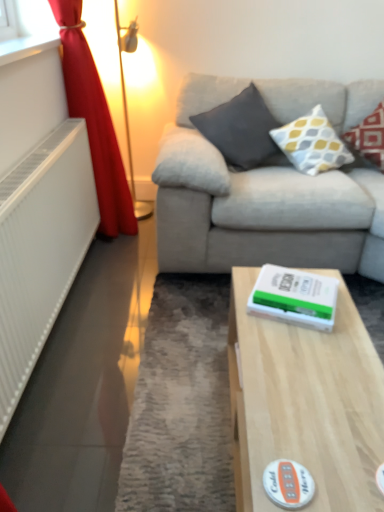
The image size is (384, 512). What are the coordinates of `free location above white matte paperback book at center (from a real-world perspective)` in the screenshot? It's located at (301, 286).